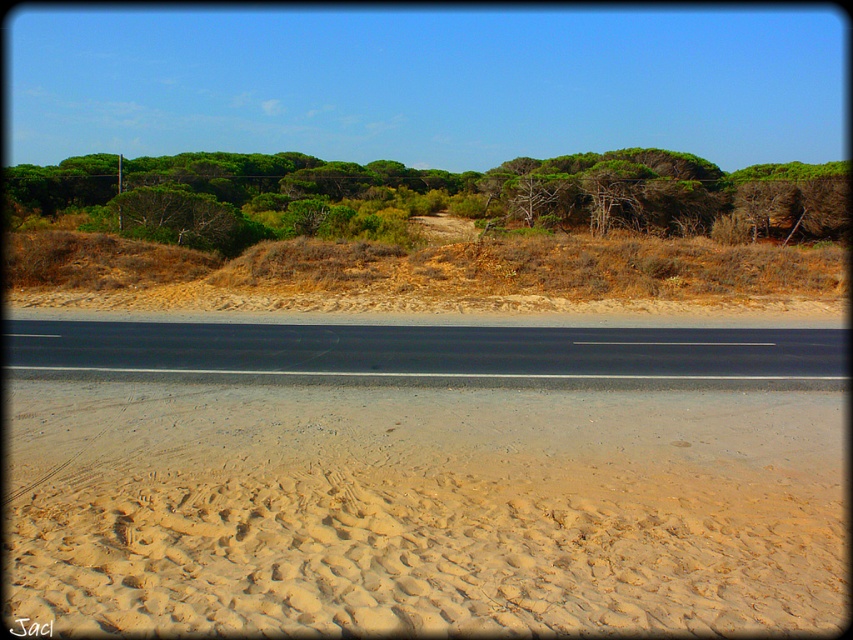
Does green leafy trees at upper center appear on the right side of black asphalt road at center?

In fact, green leafy trees at upper center is to the left of black asphalt road at center.

Between green leafy trees at upper center and black asphalt road at center, which one has less height?

black asphalt road at center is shorter.

Measure the distance between point (469, 186) and camera.

Point (469, 186) is 88.94 meters away from camera.

This screenshot has width=853, height=640. I want to click on green leafy trees at upper center, so click(x=425, y=195).

You are a GUI agent. You are given a task and a screenshot of the screen. Output one action in this format:
    pyautogui.click(x=<x>, y=<y>)
    Task: Click on the light brown sandy beach at lower center
    This screenshot has height=640, width=853.
    Given the screenshot: What is the action you would take?
    pyautogui.click(x=424, y=509)

Can you confirm if light brown sandy beach at lower center is bigger than black asphalt road at center?

No, light brown sandy beach at lower center is not bigger than black asphalt road at center.

Does point (135, 396) come closer to viewer compared to point (375, 374)?

Yes, it is in front of point (375, 374).

Locate an element on the screen. The image size is (853, 640). light brown sandy beach at lower center is located at coordinates (424, 509).

Is light brown sandy beach at lower center in front of green leafy trees at upper center?

Yes, light brown sandy beach at lower center is closer to the viewer.

Does light brown sandy beach at lower center lie behind green leafy trees at upper center?

No, light brown sandy beach at lower center is in front of green leafy trees at upper center.

Is point (437, 412) positioned in front of point (397, 188)?

That is True.

Identify the location of light brown sandy beach at lower center. The width and height of the screenshot is (853, 640). (424, 509).